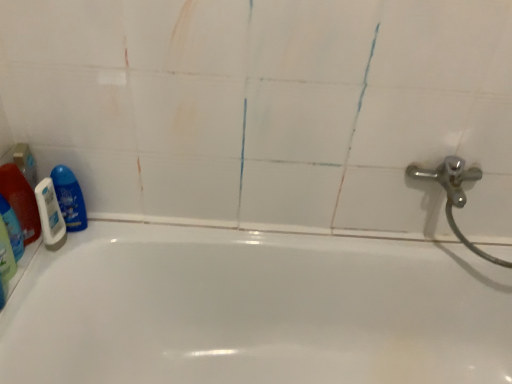
Question: Is blue glossy bottle at left, which ranks as the third cleaning product in left-to-right order, positioned behind translucent plastic bottle at left, the 1th cleaning product from the left?

Choices:
 (A) no
 (B) yes

Answer: (B)

Question: Is blue glossy bottle at left, which is the first cleaning product from right to left, taller than translucent plastic bottle at left, placed as the 3th cleaning product when sorted from right to left?

Choices:
 (A) no
 (B) yes

Answer: (A)

Question: Is blue glossy bottle at left, which ranks as the third cleaning product in left-to-right order, bigger than translucent plastic bottle at left, placed as the 3th cleaning product when sorted from right to left?

Choices:
 (A) no
 (B) yes

Answer: (B)

Question: Is blue glossy bottle at left, which is the first cleaning product from right to left, far from translucent plastic bottle at left, placed as the 3th cleaning product when sorted from right to left?

Choices:
 (A) no
 (B) yes

Answer: (A)

Question: From the image's perspective, is blue glossy bottle at left, which ranks as the third cleaning product in left-to-right order, located beneath translucent plastic bottle at left, placed as the 3th cleaning product when sorted from right to left?

Choices:
 (A) yes
 (B) no

Answer: (B)

Question: Is blue glossy bottle at left, which is the first cleaning product from right to left, turned away from translucent plastic bottle at left, the 1th cleaning product from the left?

Choices:
 (A) yes
 (B) no

Answer: (B)

Question: Is translucent plastic bottle at left, which appears as the 2th cleaning product when viewed from the right, positioned behind blue glossy bottle at left, which ranks as the third cleaning product in left-to-right order?

Choices:
 (A) no
 (B) yes

Answer: (A)

Question: Is translucent plastic bottle at left, which appears as the 2th cleaning product when viewed from the right, placed right next to blue glossy bottle at left, which is the first cleaning product from right to left?

Choices:
 (A) no
 (B) yes

Answer: (B)

Question: Is translucent plastic bottle at left, positioned as the second cleaning product in left-to-right order, smaller than blue glossy bottle at left, which ranks as the third cleaning product in left-to-right order?

Choices:
 (A) no
 (B) yes

Answer: (B)

Question: Does translucent plastic bottle at left, which appears as the 2th cleaning product when viewed from the right, appear on the right side of blue glossy bottle at left, which ranks as the third cleaning product in left-to-right order?

Choices:
 (A) yes
 (B) no

Answer: (B)

Question: From the image's perspective, is translucent plastic bottle at left, which appears as the 2th cleaning product when viewed from the right, on top of blue glossy bottle at left, which ranks as the third cleaning product in left-to-right order?

Choices:
 (A) no
 (B) yes

Answer: (A)

Question: Is translucent plastic bottle at left, which appears as the 2th cleaning product when viewed from the right, surrounding blue glossy bottle at left, which is the first cleaning product from right to left?

Choices:
 (A) no
 (B) yes

Answer: (A)

Question: Is white matte shaving cream at left at the back of translucent plastic bottle at left, which appears as the 2th cleaning product when viewed from the right?

Choices:
 (A) no
 (B) yes

Answer: (B)